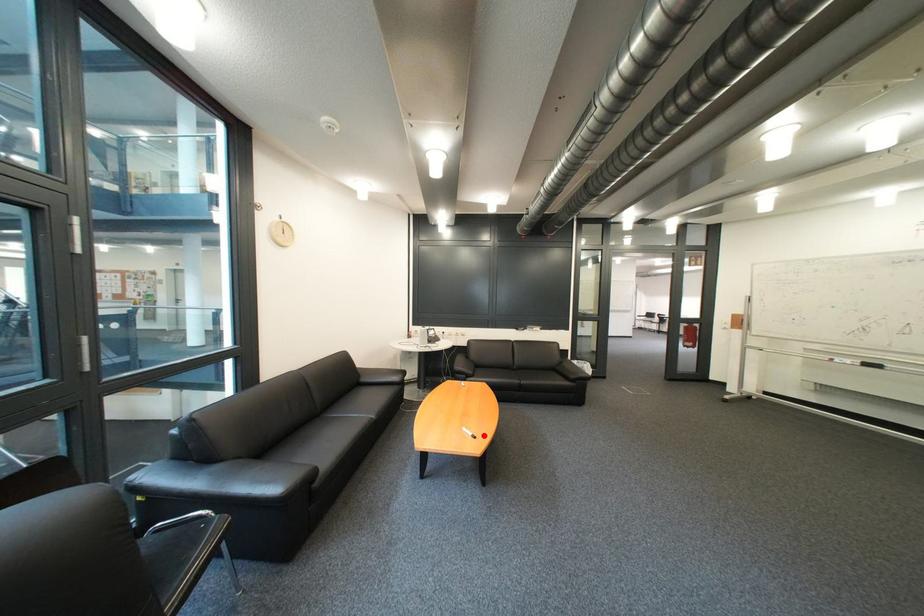
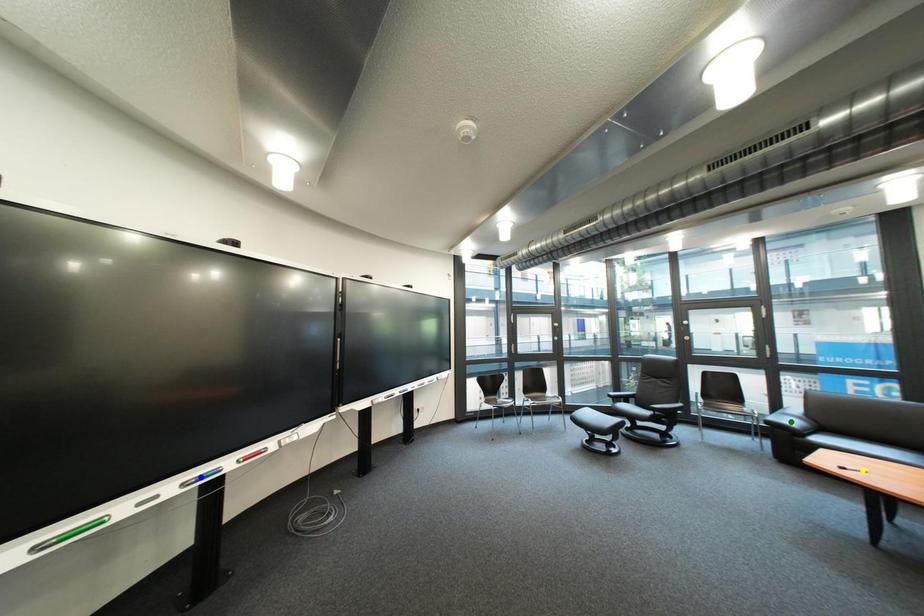
Question: I am providing you with two images of the same scene from different viewpoints. A red point is marked on the first image. You are given multiple points on the second image. Which point in image 2 represents the same 3d spot as the red point in image 1?

Choices:
 (A) green point
 (B) blue point
 (C) yellow point

Answer: (C)